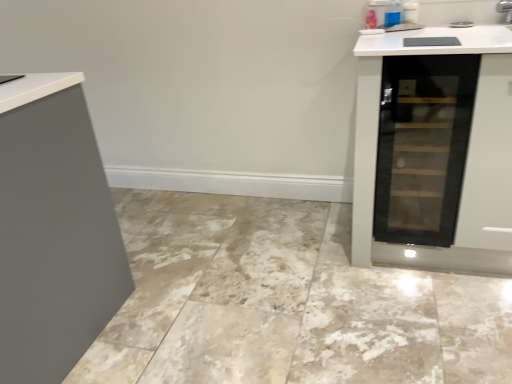
Where is `marble tile at center`? This screenshot has height=384, width=512. marble tile at center is located at coordinates (285, 302).

Describe the element at coordinates (285, 302) in the screenshot. This screenshot has height=384, width=512. I see `marble tile at center` at that location.

I want to click on transparent glass wine cooler at right, so click(422, 146).

Measure the distance between transparent glass wine cooler at right and camera.

The distance of transparent glass wine cooler at right from camera is 4.40 feet.

Describe the element at coordinates (422, 146) in the screenshot. The image size is (512, 384). I see `transparent glass wine cooler at right` at that location.

The width and height of the screenshot is (512, 384). I want to click on marble tile at center, so click(x=285, y=302).

In the scene shown: Which is more to the left, marble tile at center or transparent glass wine cooler at right?

marble tile at center is more to the left.

Is marble tile at center further to the viewer compared to transparent glass wine cooler at right?

No, it is not.

Is point (137, 350) positioned before point (440, 140)?

Yes, point (137, 350) is closer to viewer.

From the image's perspective, which is above, marble tile at center or transparent glass wine cooler at right?

transparent glass wine cooler at right, from the image's perspective.

From a real-world perspective, is marble tile at center below transparent glass wine cooler at right?

Correct, in the physical world, marble tile at center is lower than transparent glass wine cooler at right.

Which object is wider, marble tile at center or transparent glass wine cooler at right?

marble tile at center.

Does marble tile at center have a greater height compared to transparent glass wine cooler at right?

No, marble tile at center is not taller than transparent glass wine cooler at right.

Between marble tile at center and transparent glass wine cooler at right, which one has larger size?

marble tile at center is bigger.

Is transparent glass wine cooler at right completely or partially inside marble tile at center?

No, transparent glass wine cooler at right is located outside of marble tile at center.

Is marble tile at center in contact with transparent glass wine cooler at right?

There is a gap between marble tile at center and transparent glass wine cooler at right.

Is marble tile at center positioned with its back to transparent glass wine cooler at right?

That's not correct — marble tile at center is not looking away from transparent glass wine cooler at right.

Can you tell me how much marble tile at center and transparent glass wine cooler at right differ in facing direction?

The angular difference between marble tile at center and transparent glass wine cooler at right is 89.9 degrees.

Identify the location of glass door lying on the right of marble tile at center. (422, 146).

Does transparent glass wine cooler at right appear on the right side of marble tile at center?

Yes, transparent glass wine cooler at right is to the right of marble tile at center.

Is transparent glass wine cooler at right closer to camera compared to marble tile at center?

No.

Does point (451, 55) come farther from viewer compared to point (477, 365)?

That is True.

From the image's perspective, which one is positioned lower, transparent glass wine cooler at right or marble tile at center?

marble tile at center is shown below in the image.

From a real-world perspective, does transparent glass wine cooler at right stand above marble tile at center?

Yes, from a real-world perspective, transparent glass wine cooler at right is above marble tile at center.

Does transparent glass wine cooler at right have a lesser width compared to marble tile at center?

Yes.

Based on the photo, is transparent glass wine cooler at right taller or shorter than marble tile at center?

Considering their sizes, transparent glass wine cooler at right has more height than marble tile at center.

Based on their sizes in the image, would you say transparent glass wine cooler at right is bigger or smaller than marble tile at center?

In the image, transparent glass wine cooler at right appears to be smaller than marble tile at center.

Is transparent glass wine cooler at right spatially inside marble tile at center, or outside of it?

transparent glass wine cooler at right is spatially situated outside marble tile at center.

Is transparent glass wine cooler at right far away from marble tile at center?

transparent glass wine cooler at right is near marble tile at center, not far away.

Is transparent glass wine cooler at right looking in the opposite direction of marble tile at center?

transparent glass wine cooler at right does not have its back to marble tile at center.

The height and width of the screenshot is (384, 512). In order to click on ceramic tile lying below the transparent glass wine cooler at right (from the image's perspective) in this screenshot , I will do `click(285, 302)`.

The width and height of the screenshot is (512, 384). What are the coordinates of `glass door above the marble tile at center (from a real-world perspective)` in the screenshot? It's located at (422, 146).

Find the location of a particular element. Image resolution: width=512 pixels, height=384 pixels. ceramic tile beneath the transparent glass wine cooler at right (from a real-world perspective) is located at coordinates (285, 302).